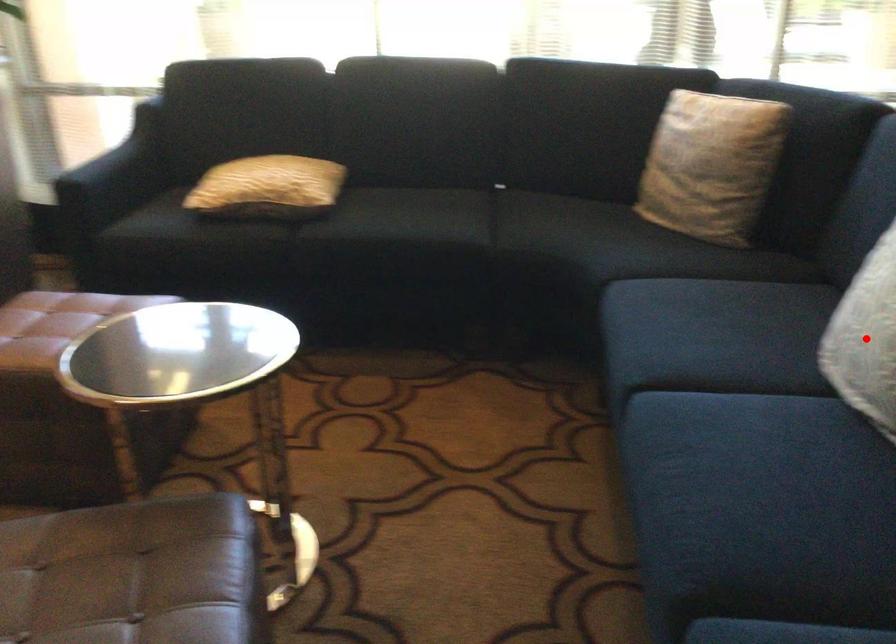
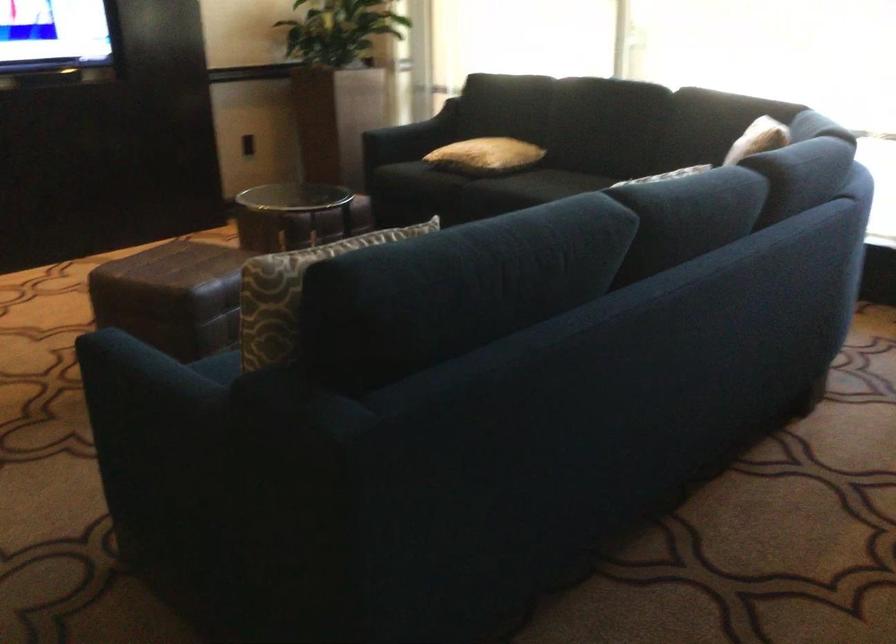
Question: I am providing you with two images of the same scene from different viewpoints. A red point is marked on the first image. Is the red point's position out of view in image 2?

Choices:
 (A) Yes
 (B) No

Answer: (A)